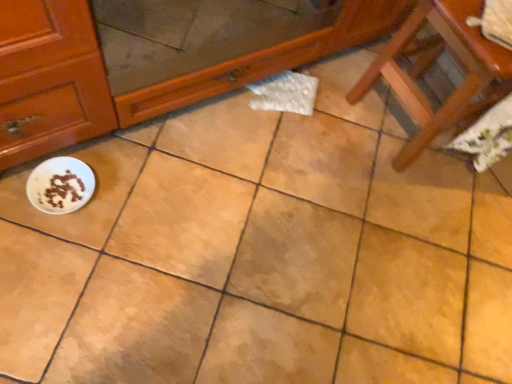
What do you see at coordinates (60, 185) in the screenshot?
I see `white glossy bowl at lower left` at bounding box center [60, 185].

Measure the distance between white glossy bowl at lower left and camera.

white glossy bowl at lower left is 39.02 inches away from camera.

Locate an element on the screen. This screenshot has width=512, height=384. white glossy bowl at lower left is located at coordinates (60, 185).

I want to click on wooden chair at lower right, so click(x=431, y=65).

The height and width of the screenshot is (384, 512). What do you see at coordinates (431, 65) in the screenshot?
I see `wooden chair at lower right` at bounding box center [431, 65].

This screenshot has height=384, width=512. I want to click on white glossy bowl at lower left, so click(60, 185).

Considering the positions of objects white glossy bowl at lower left and wooden chair at lower right in the image provided, who is more to the right, white glossy bowl at lower left or wooden chair at lower right?

wooden chair at lower right is more to the right.

Considering their positions, is white glossy bowl at lower left located in front of or behind wooden chair at lower right?

white glossy bowl at lower left is behind wooden chair at lower right.

Which is behind, point (49, 187) or point (410, 102)?

Positioned behind is point (410, 102).

From the image's perspective, which one is positioned lower, white glossy bowl at lower left or wooden chair at lower right?

white glossy bowl at lower left appears lower in the image.

From a real-world perspective, is white glossy bowl at lower left below wooden chair at lower right?

Yes, from a real-world perspective, white glossy bowl at lower left is below wooden chair at lower right.

Which object is thinner, white glossy bowl at lower left or wooden chair at lower right?

Thinner between the two is white glossy bowl at lower left.

Which of these two, white glossy bowl at lower left or wooden chair at lower right, stands taller?

wooden chair at lower right is taller.

Based on their sizes in the image, would you say white glossy bowl at lower left is bigger or smaller than wooden chair at lower right?

In the image, white glossy bowl at lower left appears to be smaller than wooden chair at lower right.

Is white glossy bowl at lower left located outside wooden chair at lower right?

Indeed, white glossy bowl at lower left is completely outside wooden chair at lower right.

Is white glossy bowl at lower left positioned far away from wooden chair at lower right?

No.

Is white glossy bowl at lower left oriented away from wooden chair at lower right?

white glossy bowl at lower left is not turned away from wooden chair at lower right.

I want to click on furniture above the white glossy bowl at lower left (from the image's perspective), so click(x=431, y=65).

Which object is positioned more to the right, wooden chair at lower right or white glossy bowl at lower left?

Positioned to the right is wooden chair at lower right.

Which object is closer to the camera taking this photo, wooden chair at lower right or white glossy bowl at lower left?

Positioned in front is wooden chair at lower right.

Which is more distant, (458,49) or (57,200)?

The point (57,200) is behind.

From the image's perspective, is wooden chair at lower right beneath white glossy bowl at lower left?

Actually, wooden chair at lower right appears above white glossy bowl at lower left in the image.

From the picture: From a real-world perspective, is wooden chair at lower right positioned above or below white glossy bowl at lower left?

wooden chair at lower right is situated higher than white glossy bowl at lower left in the real world.

Which of these two, wooden chair at lower right or white glossy bowl at lower left, is wider?

Wider between the two is wooden chair at lower right.

Does wooden chair at lower right have a greater height compared to white glossy bowl at lower left?

Correct, wooden chair at lower right is much taller as white glossy bowl at lower left.

Does wooden chair at lower right have a smaller size compared to white glossy bowl at lower left?

Actually, wooden chair at lower right might be larger than white glossy bowl at lower left.

Could white glossy bowl at lower left be considered to be inside wooden chair at lower right?

No, white glossy bowl at lower left is located outside of wooden chair at lower right.

Are wooden chair at lower right and white glossy bowl at lower left far apart?

wooden chair at lower right is near white glossy bowl at lower left, not far away.

Is wooden chair at lower right aimed at white glossy bowl at lower left?

Yes.

Can you tell me how much wooden chair at lower right and white glossy bowl at lower left differ in facing direction?

The angular difference between wooden chair at lower right and white glossy bowl at lower left is 90.9 degrees.

Identify the location of meal that is under the wooden chair at lower right (from a real-world perspective). Image resolution: width=512 pixels, height=384 pixels. (60, 185).

Image resolution: width=512 pixels, height=384 pixels. I want to click on furniture that appears on the right of white glossy bowl at lower left, so [431, 65].

You are a GUI agent. You are given a task and a screenshot of the screen. Output one action in this format:
    pyautogui.click(x=<x>, y=<y>)
    Task: Click on the furniture that appears in front of the white glossy bowl at lower left
    
    Given the screenshot: What is the action you would take?
    pyautogui.click(x=431, y=65)